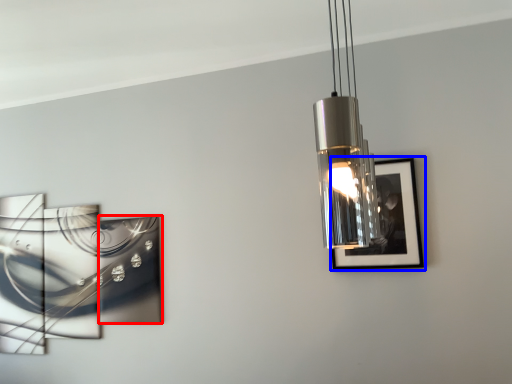
Question: Which object is further to the camera taking this photo, picture frame (highlighted by a red box) or picture frame (highlighted by a blue box)?

Choices:
 (A) picture frame
 (B) picture frame

Answer: (A)